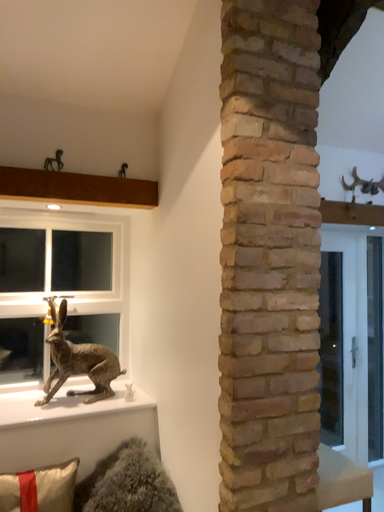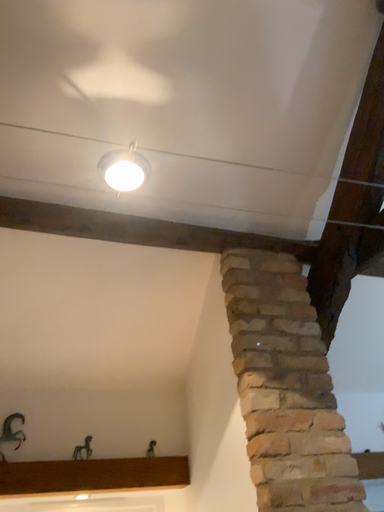
Question: Which way did the camera rotate in the video?

Choices:
 (A) rotated left
 (B) rotated right

Answer: (A)